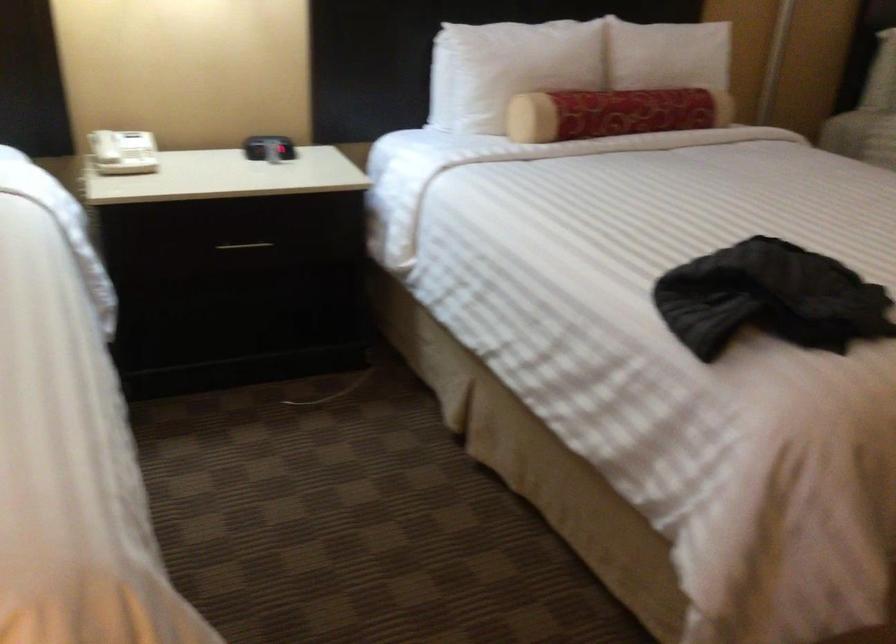
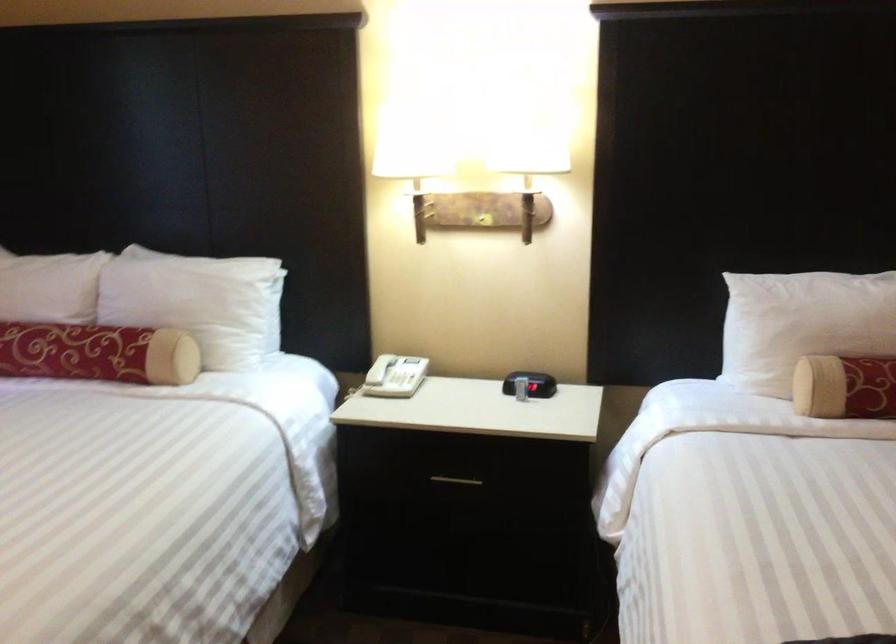
Question: Based on the continuous images, in which direction is the camera rotating? Reply with the corresponding letter.

Choices:
 (A) Left
 (B) Right
 (C) Up
 (D) Down

Answer: (A)